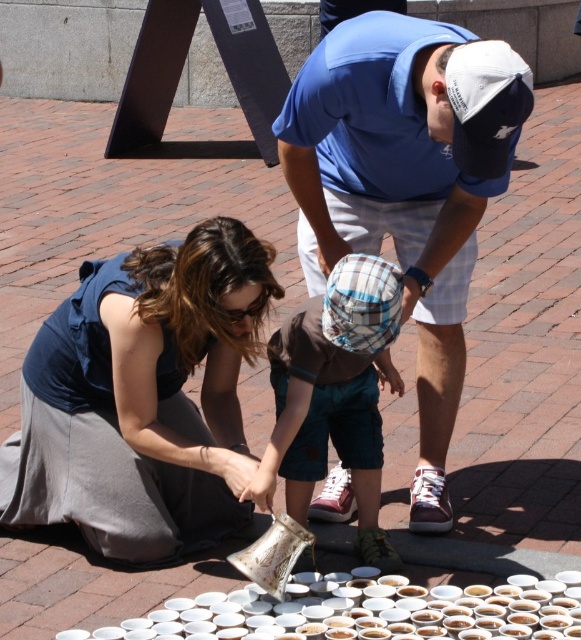
Between blue fabric dress at lower left and white matte cup at center, which one has more height?

blue fabric dress at lower left is taller.

Between point (128, 412) and point (145, 618), which one is positioned behind?

Positioned behind is point (128, 412).

Locate an element on the screen. blue fabric dress at lower left is located at coordinates (142, 397).

Is blue cotton shirt at center to the right of brown cotton shirt at center from the viewer's perspective?

Yes, blue cotton shirt at center is to the right of brown cotton shirt at center.

Consider the image. Which is above, blue cotton shirt at center or brown cotton shirt at center?

blue cotton shirt at center is higher up.

Who is more forward, (460, 198) or (379, 451)?

Point (460, 198)

This screenshot has height=640, width=581. What are the coordinates of `blue cotton shirt at center` in the screenshot? It's located at (406, 186).

Between point (260, 352) and point (465, 301), which one is positioned behind?

The point (465, 301) is more distant.

Can you confirm if blue fabric dress at lower left is bigger than blue cotton shirt at center?

No, blue fabric dress at lower left is not bigger than blue cotton shirt at center.

Is point (52, 422) positioned in front of point (505, 67)?

No, it is not.

The height and width of the screenshot is (640, 581). Identify the location of blue fabric dress at lower left. (142, 397).